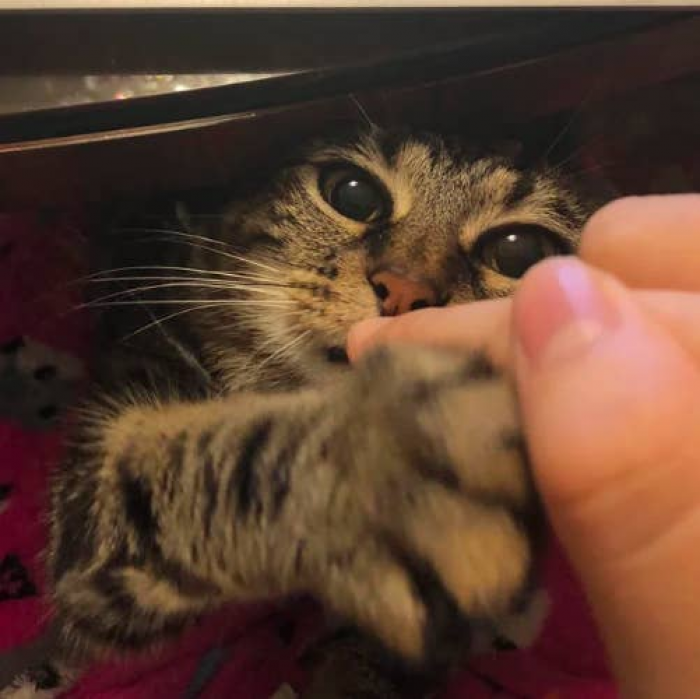
This screenshot has width=700, height=699. I want to click on pink space on blanket, so click(x=150, y=684), click(x=17, y=621), click(x=567, y=642), click(x=27, y=459), click(x=26, y=272).